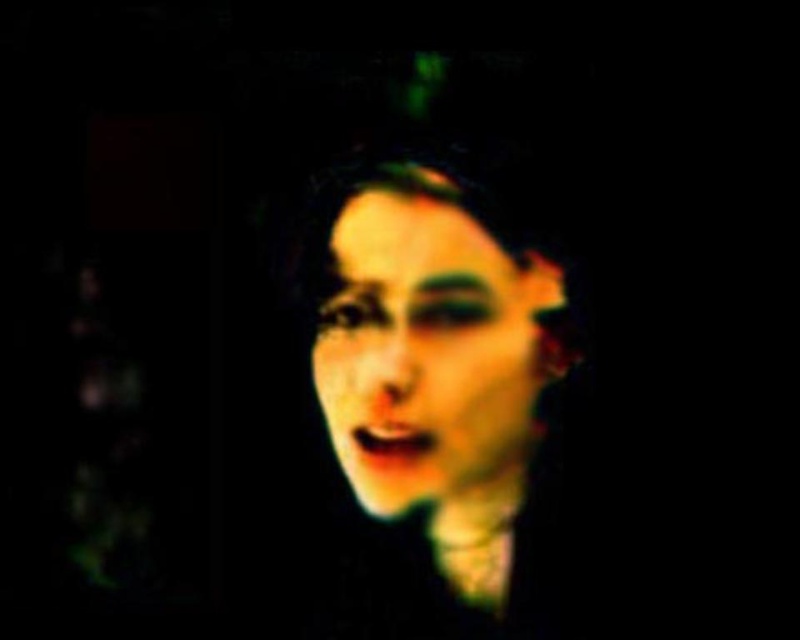
Question: Which of the following is the closest to the observer?

Choices:
 (A) matte green face at center
 (B) matte black face at center

Answer: (B)

Question: Can you confirm if matte black face at center is bigger than matte green face at center?

Choices:
 (A) no
 (B) yes

Answer: (B)

Question: Is matte black face at center below matte green face at center?

Choices:
 (A) yes
 (B) no

Answer: (A)

Question: Which of the following is the closest to the observer?

Choices:
 (A) matte green face at center
 (B) matte black face at center

Answer: (B)

Question: Is matte black face at center smaller than matte green face at center?

Choices:
 (A) yes
 (B) no

Answer: (B)